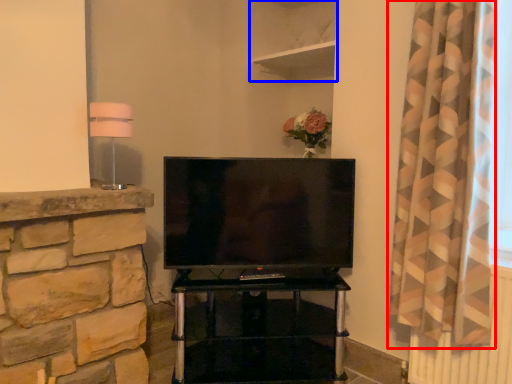
Question: Which object appears closest to the camera in this image, curtain (highlighted by a red box) or shelf (highlighted by a blue box)?

Choices:
 (A) curtain
 (B) shelf

Answer: (A)